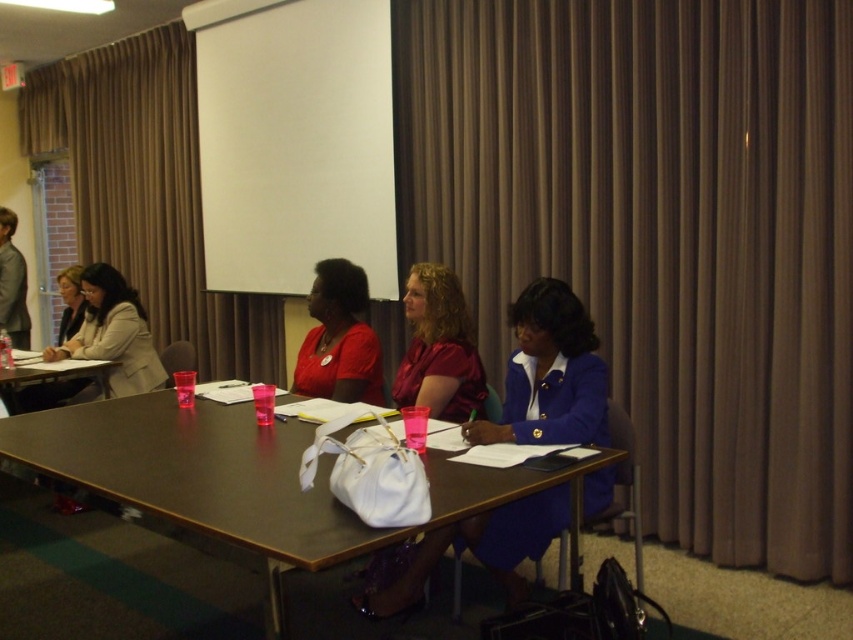
Who is more forward, (756, 13) or (550, 321)?

Point (550, 321) is in front.

The image size is (853, 640). Describe the element at coordinates (660, 234) in the screenshot. I see `brown fabric curtain at center` at that location.

Locate an element on the screen. brown fabric curtain at center is located at coordinates (660, 234).

Is white matte projection screen at center wider than matte beige blazer at left?

Indeed, white matte projection screen at center has a greater width compared to matte beige blazer at left.

Who is positioned more to the left, white matte projection screen at center or matte beige blazer at left?

From the viewer's perspective, matte beige blazer at left appears more on the left side.

At what (x,y) coordinates should I click in order to perform the action: click on white matte projection screen at center. Please return your answer as a coordinate pair (x, y). Looking at the image, I should click on (294, 141).

Does point (355, 109) come farther from viewer compared to point (543, 289)?

Yes, point (355, 109) is farther from viewer.

Who is shorter, white matte projection screen at center or blue satin blazer at center?

blue satin blazer at center

Is point (276, 74) less distant than point (512, 600)?

No.

The image size is (853, 640). I want to click on white matte projection screen at center, so click(294, 141).